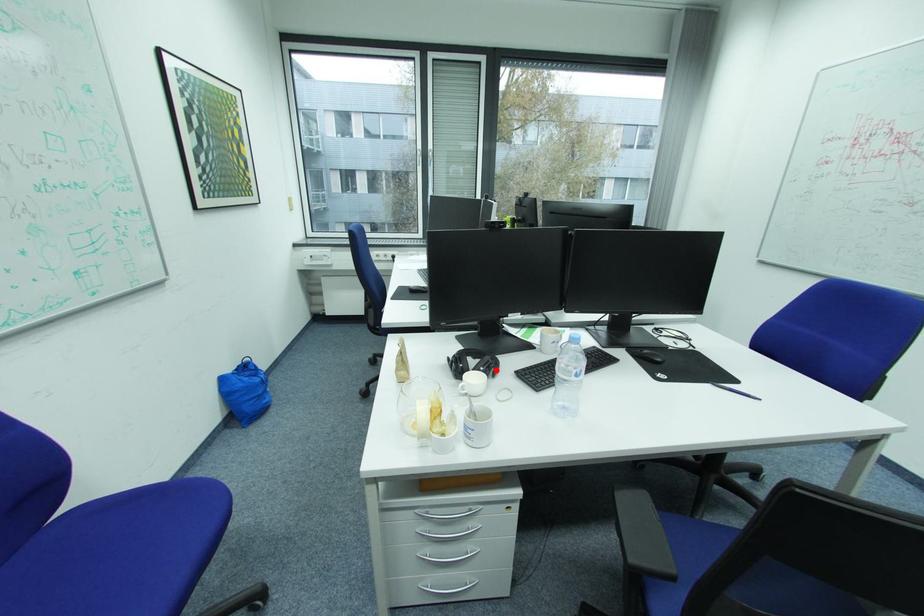
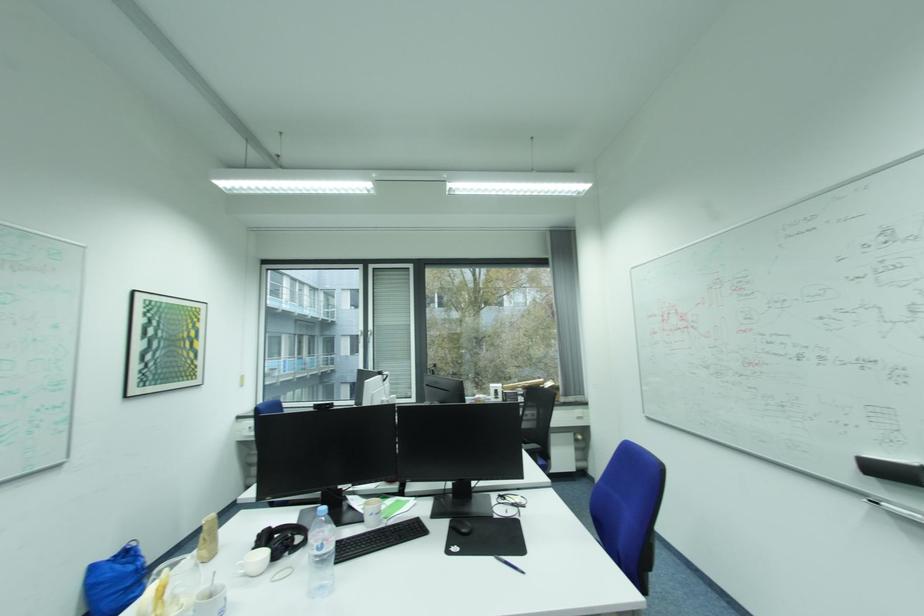
In the second image, find the point that corresponds to the highlighted location in the first image.

(287, 546)